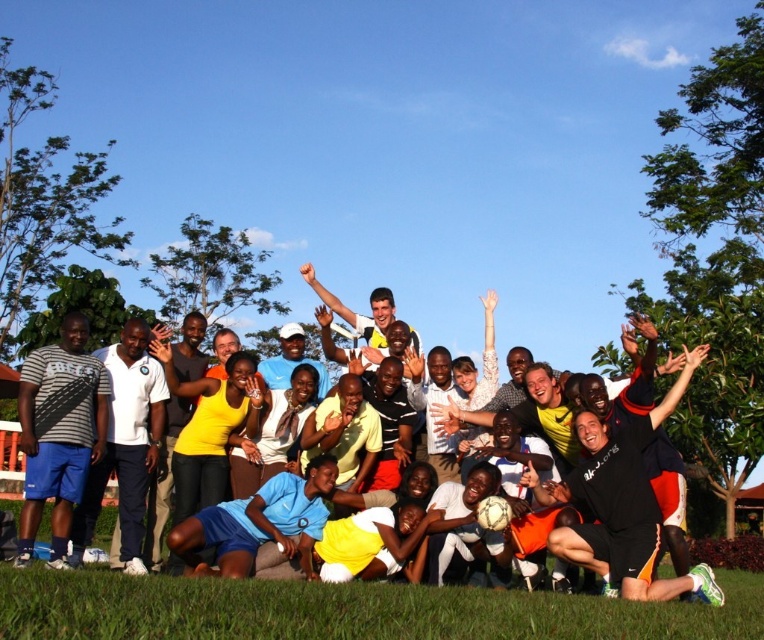
Question: Is green grass at lower center to the left of matte gray shorts at left from the viewer's perspective?

Choices:
 (A) yes
 (B) no

Answer: (B)

Question: Which object appears farthest from the camera in this image?

Choices:
 (A) yellow jersey at center
 (B) matte gray shorts at left
 (C) green grass at lower center
 (D) matte black shirt at left

Answer: (A)

Question: Can you confirm if matte gray shorts at left is bigger than yellow jersey at center?

Choices:
 (A) yes
 (B) no

Answer: (A)

Question: Can you confirm if green grass at lower center is positioned below matte black shirt at left?

Choices:
 (A) no
 (B) yes

Answer: (B)

Question: Which object appears closest to the camera in this image?

Choices:
 (A) yellow jersey at center
 (B) matte black shirt at left
 (C) matte gray shorts at left

Answer: (B)

Question: Estimate the real-world distances between objects in this image. Which object is farther from the matte gray shorts at left?

Choices:
 (A) yellow jersey at center
 (B) green grass at lower center

Answer: (B)